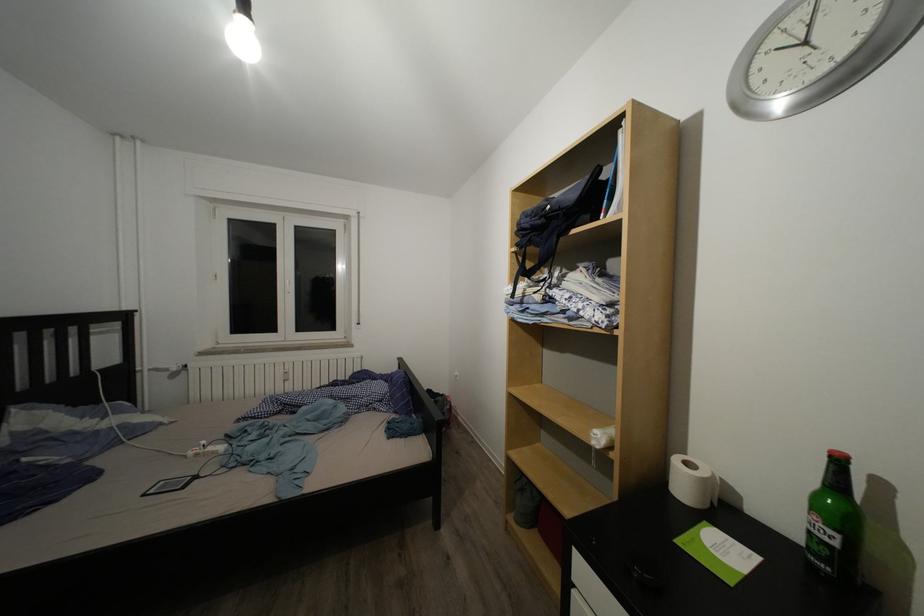
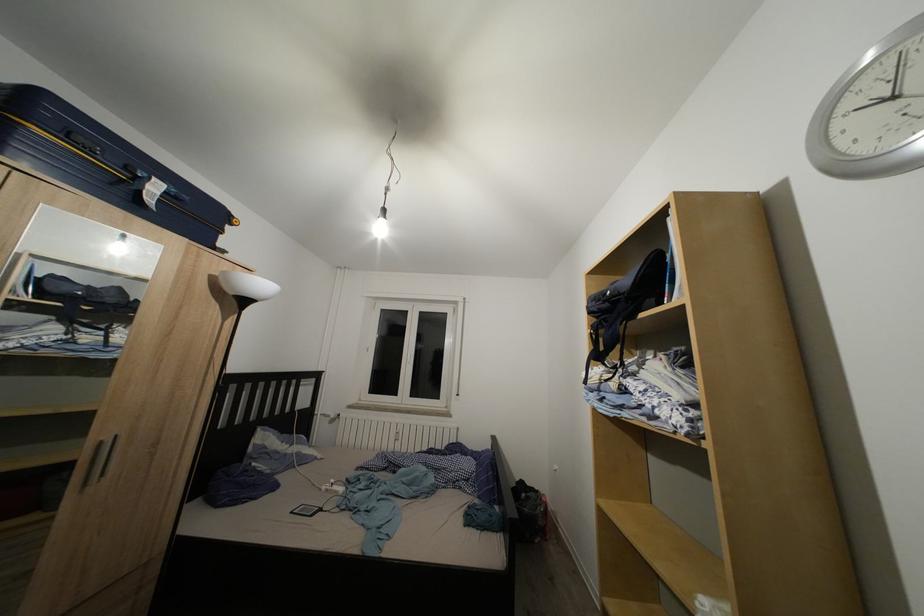
How did the camera likely rotate?

The rotation direction of the camera is left-up.